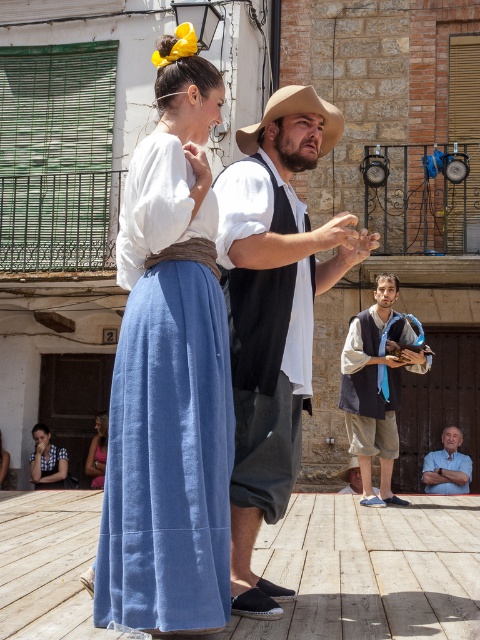
Question: In this image, where is matte white blouse at upper left located relative to light brown felt cowboy hat at center?

Choices:
 (A) above
 (B) below

Answer: (B)

Question: Which of the following is the farthest from the observer?

Choices:
 (A) (323, 106)
 (B) (131, 600)

Answer: (A)

Question: Is matte white blouse at upper left wider than light brown felt cowboy hat at center?

Choices:
 (A) yes
 (B) no

Answer: (A)

Question: Based on their relative distances, which object is farther from the light brown felt cowboy hat at center?

Choices:
 (A) light blue shirt at lower right
 (B) silky pink dress at lower left
 (C) matte white shirt at center
 (D) matte white blouse at upper left

Answer: (B)

Question: Which is farther from the matte white blouse at upper left?

Choices:
 (A) light brown felt cowboy hat at center
 (B) dark brown leather vest at center

Answer: (B)

Question: Is matte white shirt at center bigger than light brown felt cowboy hat at center?

Choices:
 (A) no
 (B) yes

Answer: (B)